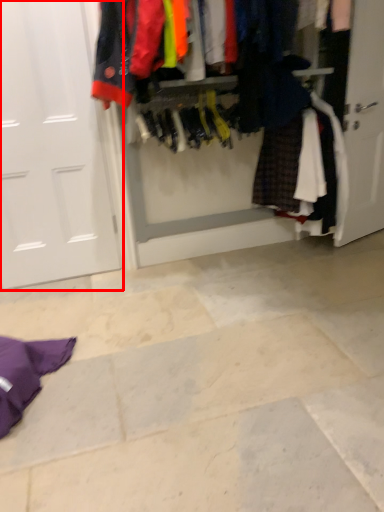
Question: Where is door (annotated by the red box) located in relation to closet in the image?

Choices:
 (A) left
 (B) right

Answer: (A)